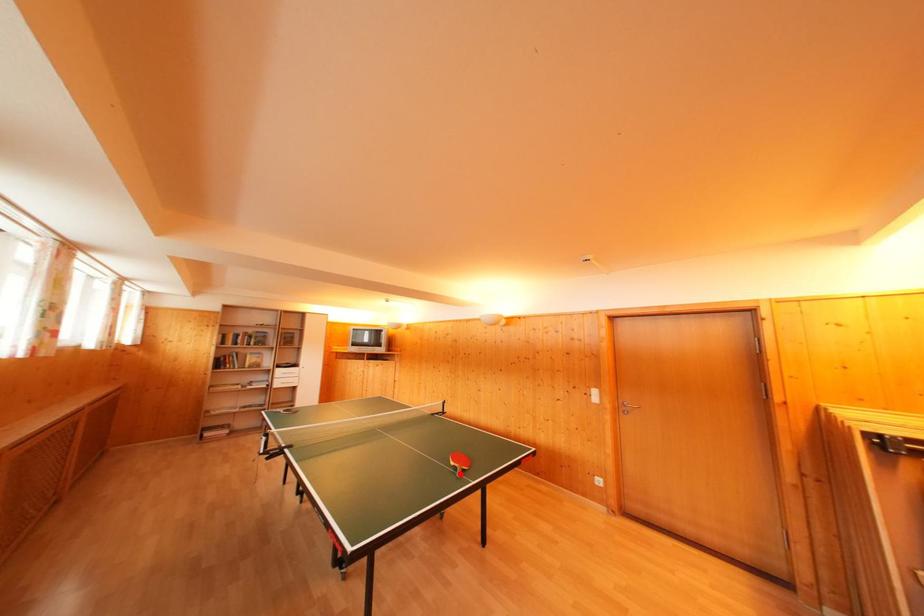
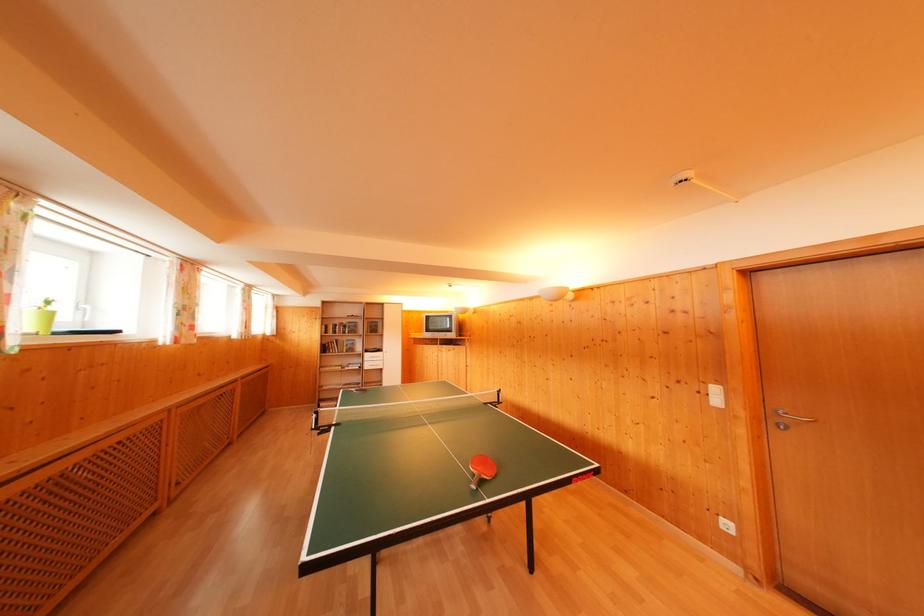
Question: I am providing you with two images of the same scene from different viewpoints. A red point is marked on the first image. Is the red point's position out of view in image 2?

Choices:
 (A) Yes
 (B) No

Answer: (B)